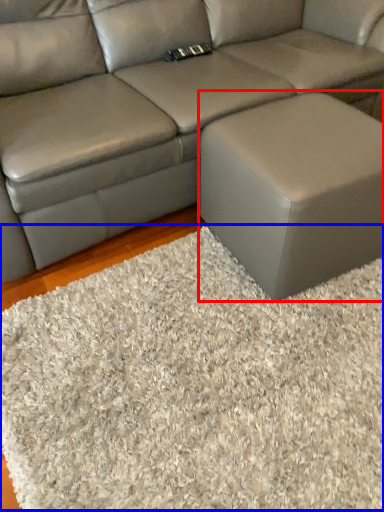
Question: Among these objects, which one is farthest to the camera, stool (highlighted by a red box) or mat (highlighted by a blue box)?

Choices:
 (A) stool
 (B) mat

Answer: (A)